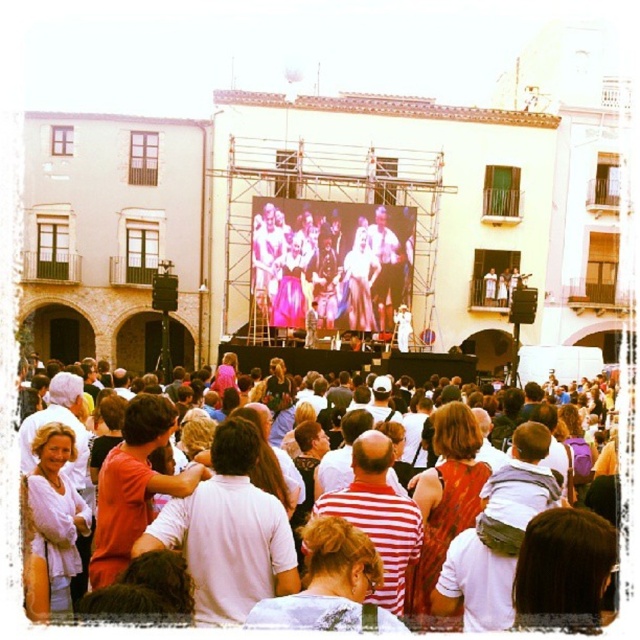
You are a photographer positioned at the edge of the white cotton crowd at center. You want to capture a closeup shot of the matte pink dress at center without moving closer. Which zoom level should you use? The camera has a minimum zoom of 25 meters and maximum zoom of 10 meters.

The matte pink dress at center is 15.56 meters away from the white cotton crowd at center. Since the camera can zoom as close as 10 meters, you should set the zoom to 10 meters to capture the closeup shot.

You are a photographer at the event and want to capture a photo that includes both the matte pink dress at center and the white cotton crowd at center. Based on their positions, which object should be placed on the left side of your photo?

The matte pink dress at center is positioned on the left side of white cotton crowd at center, so in your photo, the matte pink dress at center should be placed on the left side.